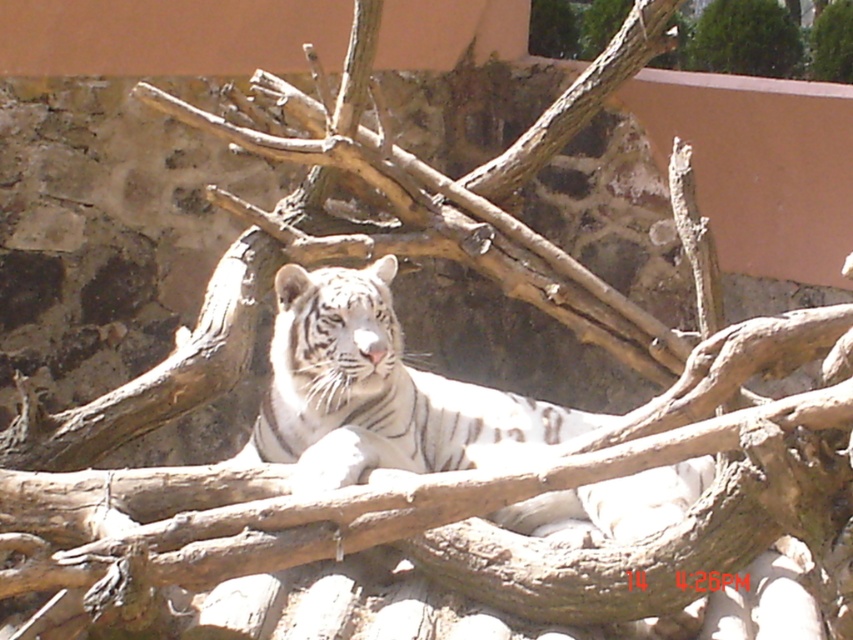
Is white striped tiger at center smaller than green leafy tree at upper right?

Incorrect, white striped tiger at center is not smaller in size than green leafy tree at upper right.

Does white striped tiger at center lie behind green leafy tree at upper right?

No.

Is point (321, 410) more distant than point (734, 49)?

That is False.

This screenshot has width=853, height=640. I want to click on white striped tiger at center, so click(x=378, y=392).